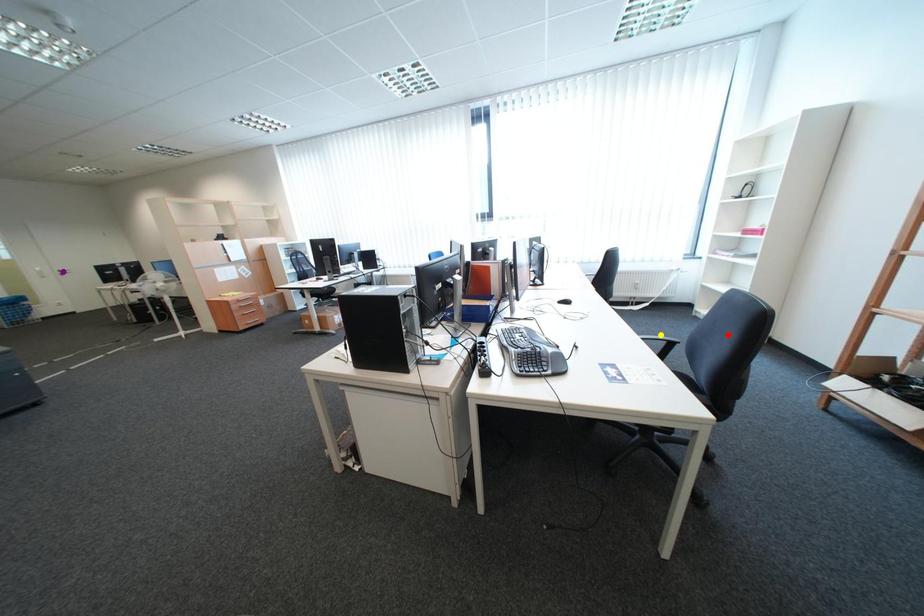
Order these from nearest to farthest:
A) purple point
B) yellow point
C) red point

purple point < red point < yellow point